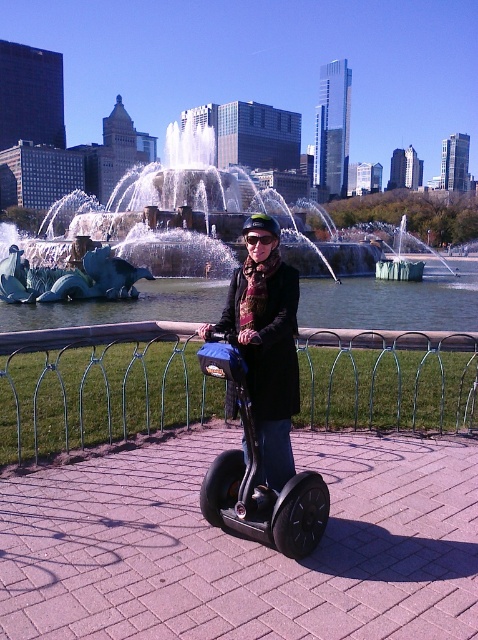
Question: Which point appears closest to the camera in this image?

Choices:
 (A) (201, 368)
 (B) (264, 243)
 (C) (161, 180)

Answer: (A)

Question: Is polished stone fountain at center positioned in front of matte black segway at center?

Choices:
 (A) no
 (B) yes

Answer: (A)

Question: Can you confirm if metal wire fence at lower center is positioned above polished stone fountain at center?

Choices:
 (A) no
 (B) yes

Answer: (A)

Question: Based on their relative distances, which object is nearer to the black rubber segway at center?

Choices:
 (A) polished stone fountain at center
 (B) black plastic goggles at center
 (C) metal wire fence at lower center
 (D) matte black segway at center

Answer: (D)

Question: Is metal wire fence at lower center below black rubber segway at center?

Choices:
 (A) no
 (B) yes

Answer: (B)

Question: Estimate the real-world distances between objects in this image. Which object is closer to the black rubber segway at center?

Choices:
 (A) polished stone fountain at center
 (B) black plastic goggles at center
 (C) metal wire fence at lower center
 (D) matte black segway at center

Answer: (D)